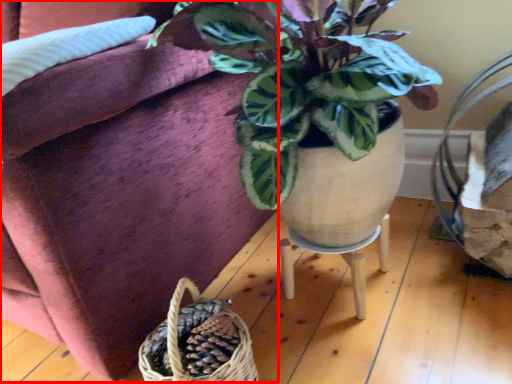
Question: Where is couch (annotated by the red box) located in relation to table in the image?

Choices:
 (A) left
 (B) right

Answer: (A)